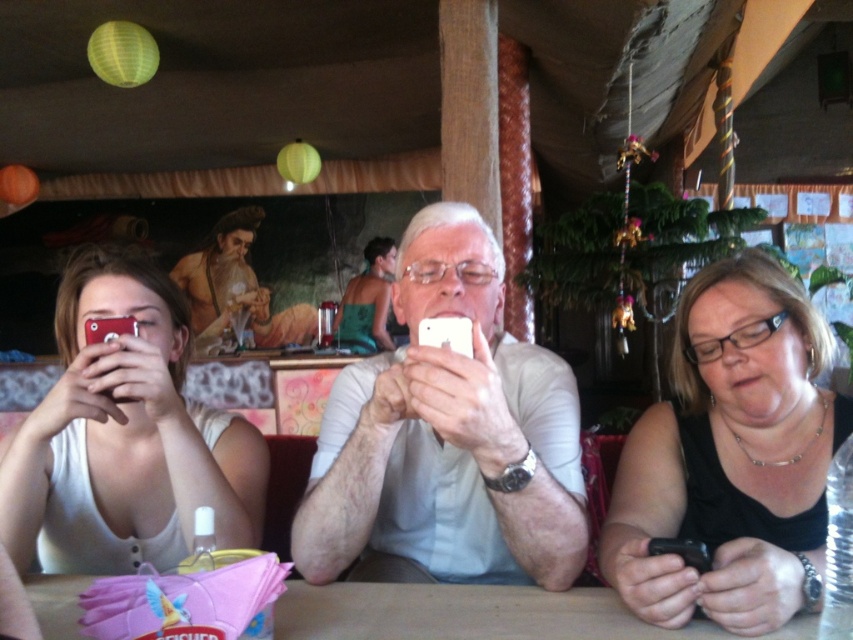
You are a photographer trying to capture a candid shot of the white matte shirt at center and the wooden table at center. Which object should you focus on first if you want to ensure both are in focus without adjusting your camera settings?

The white matte shirt at center is bigger than the wooden table at center, so you should focus on the white matte shirt at center first to ensure both are in focus.

You are a photographer taking a picture of the white matte shirt at center and the green fabric bikini top at center. Which one will appear larger in the photo?

The white matte shirt at center will appear larger in the photo because it is closer to the viewer than the green fabric bikini top at center.

You are a photographer trying to capture a candid shot of the matte white tank top at left and the green fabric bikini top at center. Since you want to include both in the frame, which direction should you position your camera relative to the subjects?

You should position your camera to the left of the subjects because the matte white tank top at left is to the left of the green fabric bikini top at center, so facing left would allow both to be in the frame.